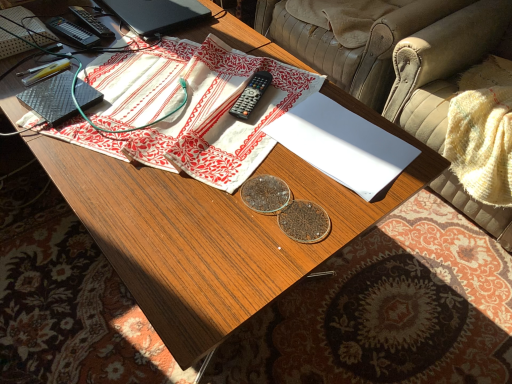
Image resolution: width=512 pixels, height=384 pixels. Find the location of `free location in front of black matte laptop at upper left`. free location in front of black matte laptop at upper left is located at coordinates (132, 56).